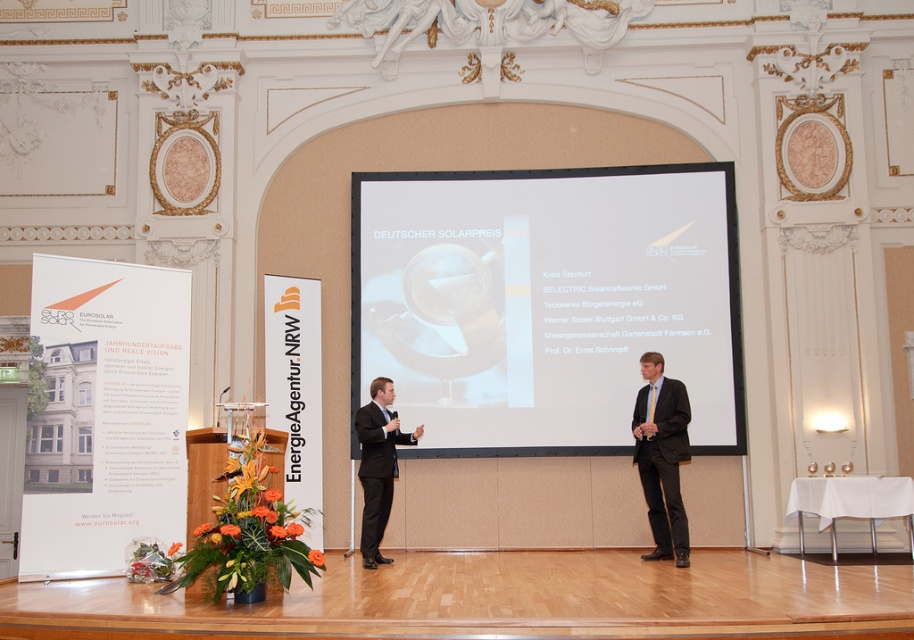
Question: Which point is closer to the camera?

Choices:
 (A) white glossy projection screen at center
 (B) dark suit at center

Answer: (B)

Question: Does white glossy projection screen at center appear over dark suit at center?

Choices:
 (A) no
 (B) yes

Answer: (B)

Question: Does white glossy projection screen at center appear on the left side of dark suit at center?

Choices:
 (A) yes
 (B) no

Answer: (A)

Question: Can you confirm if dark suit at center is positioned above matte black suit at center?

Choices:
 (A) no
 (B) yes

Answer: (B)

Question: Which object is closer to the camera taking this photo?

Choices:
 (A) matte black suit at center
 (B) dark suit at center
 (C) white glossy projection screen at center

Answer: (B)

Question: Which object is the closest to the dark suit at center?

Choices:
 (A) white glossy projection screen at center
 (B) matte black suit at center

Answer: (A)